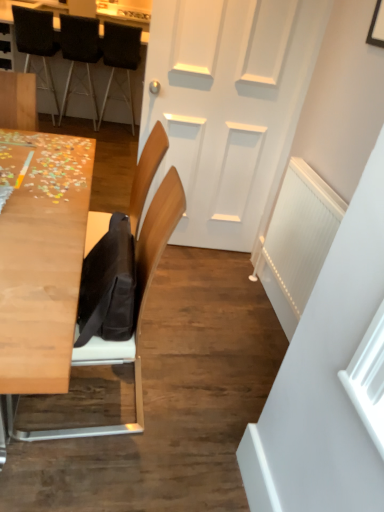
Identify the location of vacant area on top of white plastic radiator at right (from a real-world perspective). (330, 180).